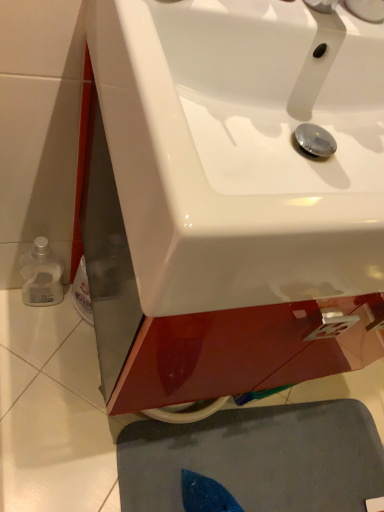
The image size is (384, 512). What are the coordinates of `vacant space underneath gray matte bath mat at lower center (from a real-world perspective)` in the screenshot? It's located at coord(279,467).